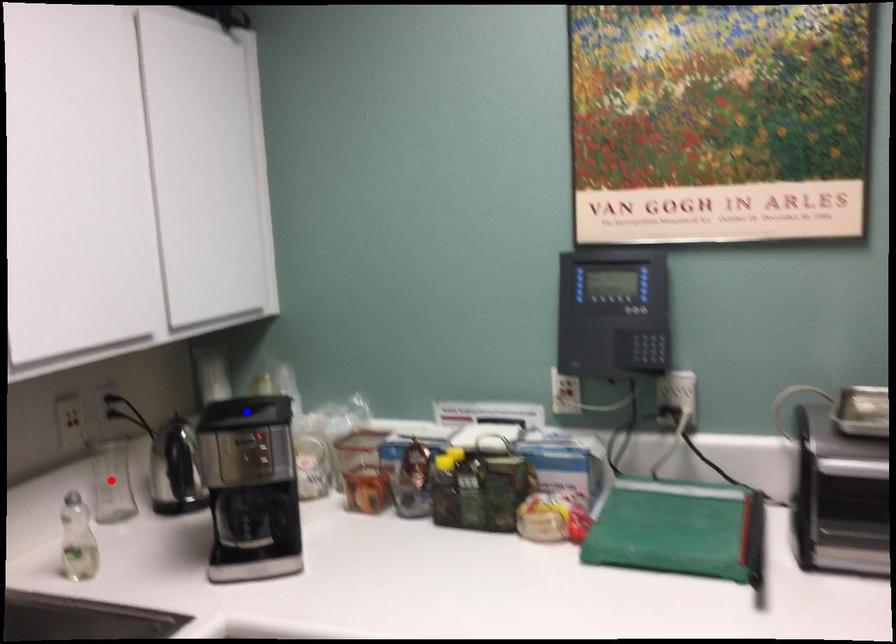
Question: In the image, two points are highlighted. Which point is nearer to the camera? Reply with the corresponding letter.

Choices:
 (A) blue point
 (B) red point

Answer: (A)